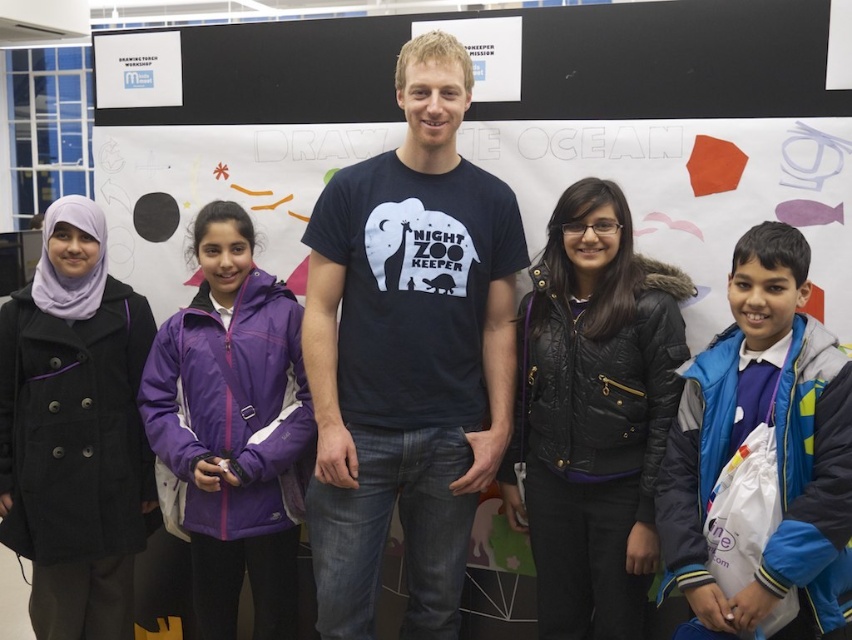
Based on the photo, you are a photographer trying to capture the black quilted jacket at center in your frame. Given that your camera has a focal length of 50mm and you are positioned 3 meters away from the jacket, will the jacket fill more than half of the frame vertically?

Answer: The black quilted jacket at center is located at point coordinates, but without knowing the camera sensor size or the exact dimensions of the jacket, it is impossible to determine if it will fill more than half the frame vertically. Additional information is needed to provide an accurate answer.

You are organizing a photo shoot and need to ensure that the black quilted jacket at center and the black wool coat at left are visible in the frame. Based on their positions, which one is more likely to be fully visible without obstruction?

The black quilted jacket at center is positioned over the black wool coat at left, meaning it is closer to the camera. Therefore, the black quilted jacket at center is more likely to be fully visible without obstruction.